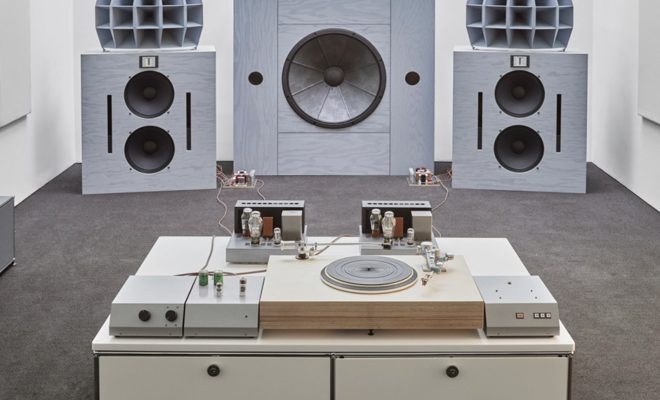
Identify the location of wooden block. (449, 308).